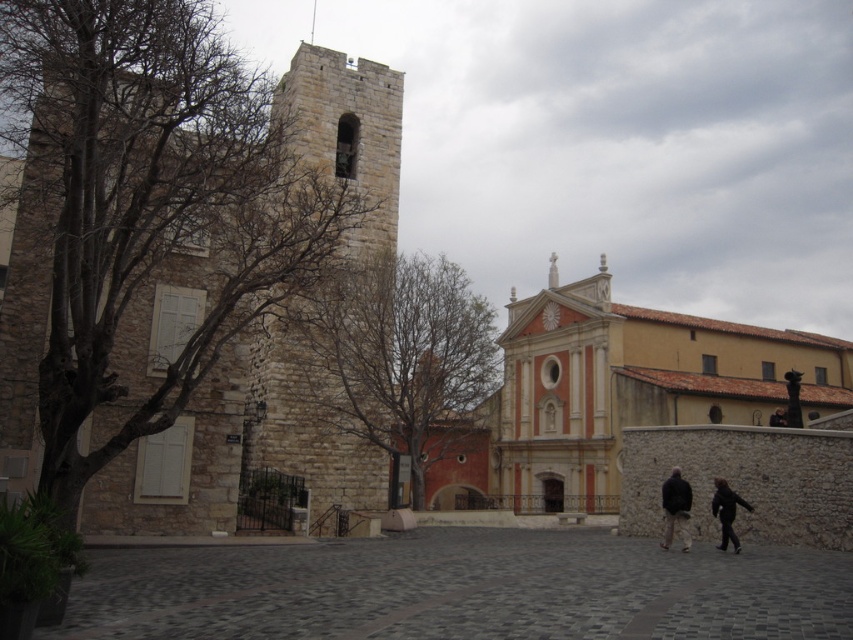
You are a city planner assessing the distance between the stone tower at left and the ornate building to its right. Given that the minimum required distance for fire safety regulations is 45 meters, is the current spacing compliant?

The stone tower at left and the ornate building to its right are 46.64 meters apart, which exceeds the 45 meter fire safety requirement. Therefore, the spacing is compliant with regulations.

You are a tourist standing at the center of the square in front of the historic stone building. You see the stone tower at left and the dark brown leather jacket at lower right. Which object is taller?

The stone tower at left is much taller than the dark brown leather jacket at lower right.

You are standing in the urban scene and want to walk from the point at coordinates point(167, 429) to the point at coordinates point(672, 506). Based on their positions, will you have to move forward or backward to reach your destination?

Since point(167, 429) is in front of point(672, 506), you will need to move backward to reach the destination point(672, 506).